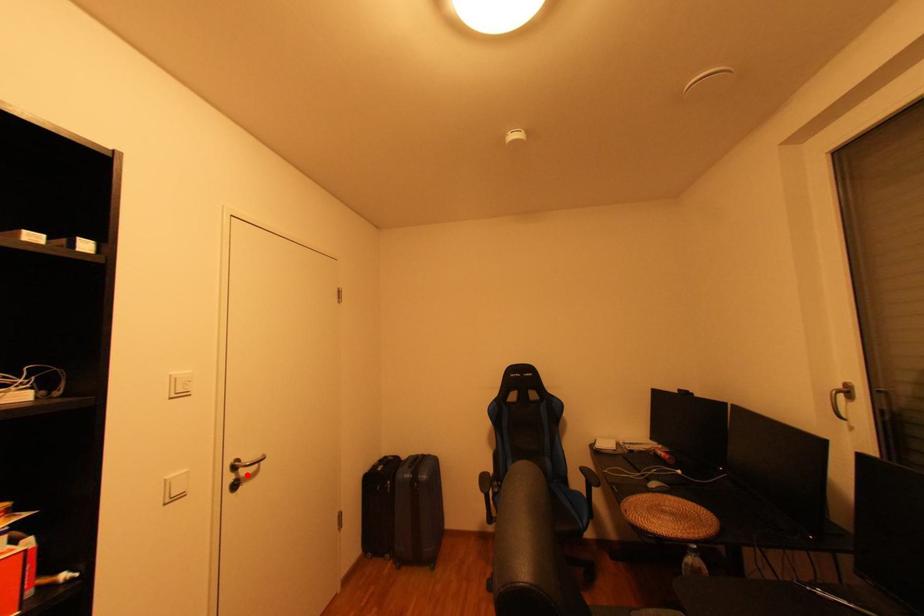
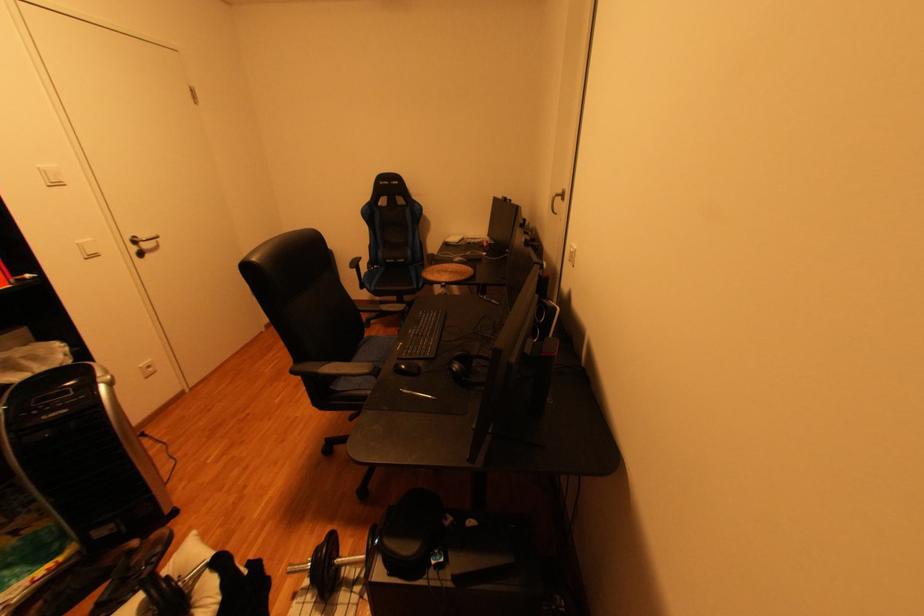
In the second image, find the point that corresponds to the highlighted location in the first image.

(150, 248)